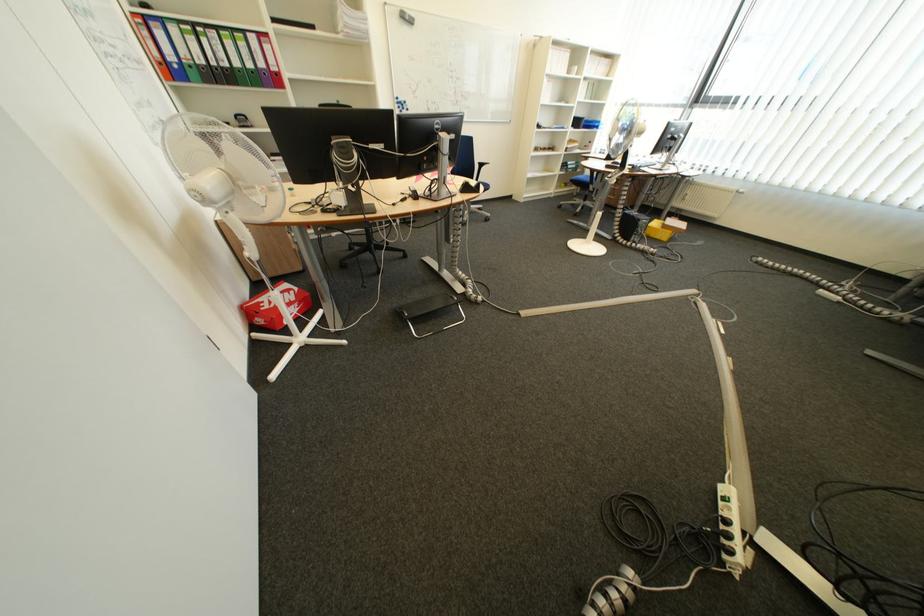
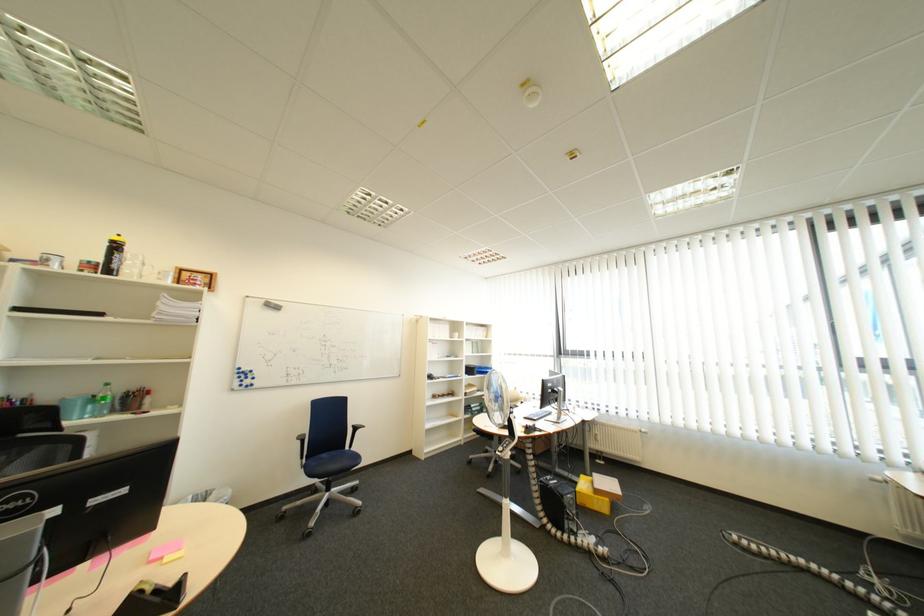
Where in the second image is the point corresponding to [657,227] from the first image?

(585, 503)